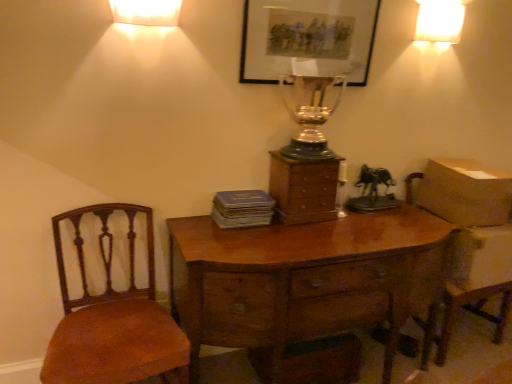
Locate an element on the screen. The image size is (512, 384). free space in front of wooden chest of drawers at center is located at coordinates (311, 236).